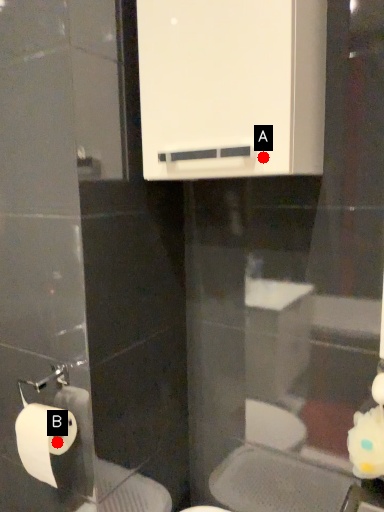
Question: Two points are circled on the image, labeled by A and B beside each circle. Among these points, which one is farthest from the camera?

Choices:
 (A) A is further
 (B) B is further

Answer: (B)